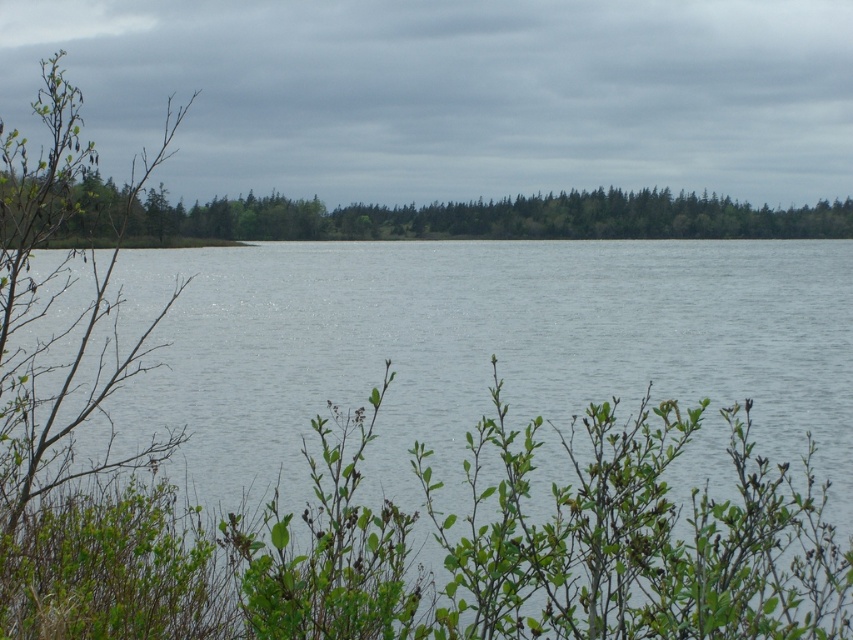
Question: Does clear water at center appear under green leafy trees at center?

Choices:
 (A) no
 (B) yes

Answer: (B)

Question: Which point is closer to the camera taking this photo?

Choices:
 (A) (35, 246)
 (B) (386, 572)

Answer: (B)

Question: Among these points, which one is farthest from the camera?

Choices:
 (A) (138, 264)
 (B) (90, 244)
 (C) (724, 196)

Answer: (C)

Question: Where is green leafy trees at center located in relation to green grass at center in the image?

Choices:
 (A) below
 (B) above

Answer: (B)

Question: Does clear water at center appear on the right side of green grass at center?

Choices:
 (A) yes
 (B) no

Answer: (A)

Question: Which object is the farthest from the green grass at center?

Choices:
 (A) green leafy trees at center
 (B) clear water at center

Answer: (B)